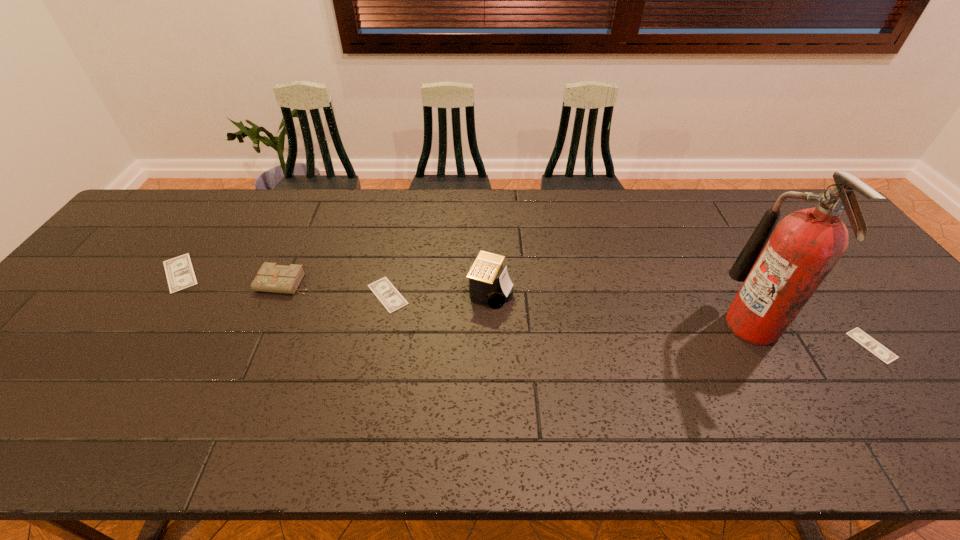
Identify the location of free area in between the leftmost object and the fire extinguisher. The image size is (960, 540). (466, 299).

Find the location of `free space between the rightmost object and the tallest object`. free space between the rightmost object and the tallest object is located at coordinates (811, 335).

This screenshot has height=540, width=960. What are the coordinates of `the closest object to the leftmost money` in the screenshot? It's located at 271,277.

Identify the location of object that stands as the third closest to the calculator. This screenshot has width=960, height=540. (780, 275).

Select which money appears as the third closest to the fire extinguisher. Please provide its 2D coordinates. Your answer should be formatted as a tuple, i.e. [(x, y)], where the tuple contains the x and y coordinates of a point satisfying the conditions above.

[(180, 275)]

Identify which money is located as the second nearest to the fire extinguisher. Please provide its 2D coordinates. Your answer should be formatted as a tuple, i.e. [(x, y)], where the tuple contains the x and y coordinates of a point satisfying the conditions above.

[(392, 300)]

Locate an element on the screen. The image size is (960, 540). free space that satisfies the following two spatial constraints: 1. on the front side of the fifth shortest object; 2. on the left side of the shortest object is located at coordinates (492, 346).

What are the coordinates of `free space that satisfies the following two spatial constraints: 1. on the front of the fire extinguisher near the operation label; 2. on the right side of the nearest money` in the screenshot? It's located at (762, 346).

Where is `vacant point that satisfies the following two spatial constraints: 1. on the back side of the second money from right to left; 2. on the right side of the second tallest object`? Image resolution: width=960 pixels, height=540 pixels. vacant point that satisfies the following two spatial constraints: 1. on the back side of the second money from right to left; 2. on the right side of the second tallest object is located at coordinates (388, 292).

This screenshot has width=960, height=540. I want to click on vacant position in the image that satisfies the following two spatial constraints: 1. on the front side of the third tallest object; 2. on the left side of the third object from right to left, so click(x=281, y=292).